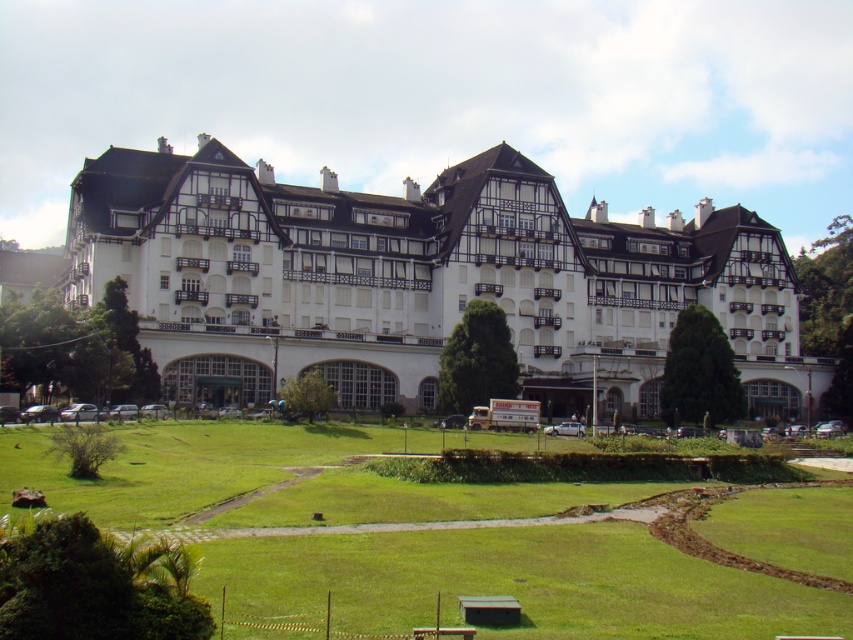
You are a landscape architect designing a new garden for the property. The white wooden hotel at center and the green grass at center are both key elements. Which element is wider in terms of their base structure?

The white wooden hotel at center might be wider than green grass at center according to the description.

You are standing at the entrance of the white wooden hotel at center. If you walk straight ahead, will you be facing the paved pathway leading up to the entrance?

The white wooden hotel at center is located at point coordinates, but the question is about the direction of the paved pathway. Since the pathway leads up to the entrance, walking straight ahead from the entrance would be away from the pathway. Therefore, you would not be facing the paved pathway leading up to the entrance.